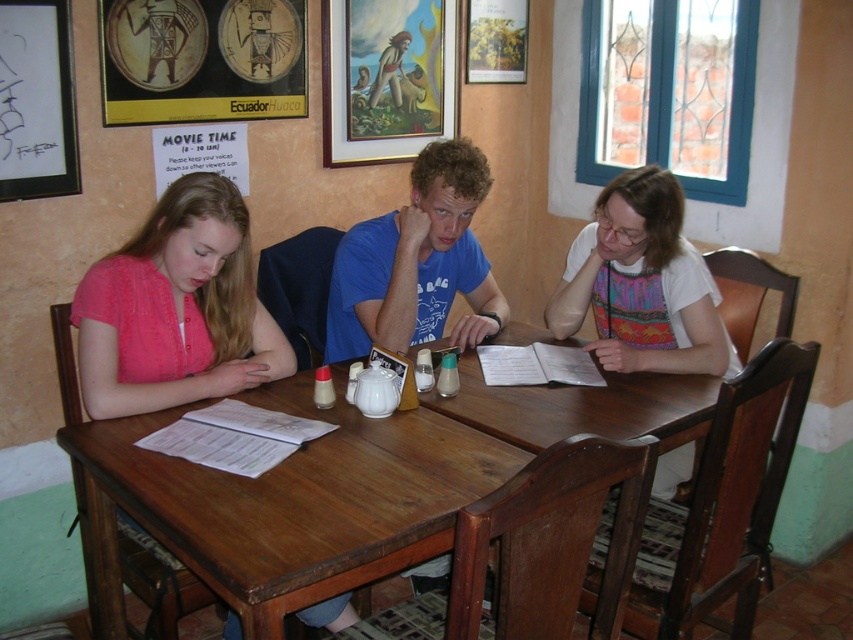
Who is taller, brown wooden table at center or wooden framed painting at upper center?

brown wooden table at center

Which is behind, point (672, 387) or point (384, 40)?

Point (384, 40)

Describe the element at coordinates (346, 484) in the screenshot. The height and width of the screenshot is (640, 853). I see `brown wooden table at center` at that location.

You are a GUI agent. You are given a task and a screenshot of the screen. Output one action in this format:
    pyautogui.click(x=<x>, y=<y>)
    Task: Click on the brown wooden table at center
    The image size is (853, 640).
    Given the screenshot: What is the action you would take?
    pyautogui.click(x=346, y=484)

Does pink fabric shirt at left have a lesser height compared to black matte picture frame at upper left?

No, pink fabric shirt at left is not shorter than black matte picture frame at upper left.

Find the location of a particular element. pink fabric shirt at left is located at coordinates (177, 308).

Locate an element on the screen. pink fabric shirt at left is located at coordinates (177, 308).

Is wooden framed painting at upper center smaller than black matte picture frame at upper left?

Incorrect, wooden framed painting at upper center is not smaller in size than black matte picture frame at upper left.

Which is in front, point (421, 113) or point (64, 109)?

Positioned in front is point (64, 109).

Does point (415, 28) come behind point (47, 186)?

That is True.

The image size is (853, 640). What are the coordinates of `wooden framed painting at upper center` in the screenshot? It's located at (386, 77).